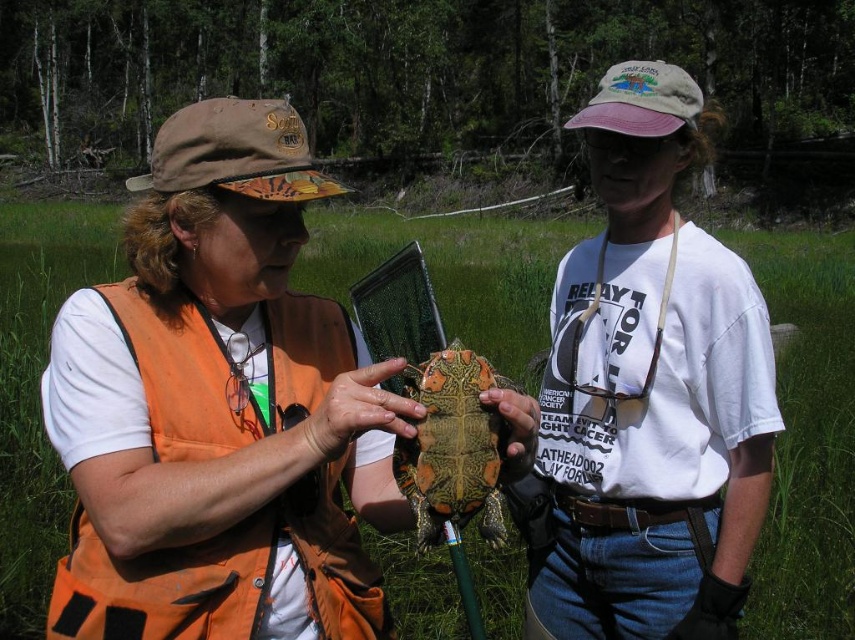
Does matte orange vest at left have a larger size compared to white cotton shirt at center?

Indeed, matte orange vest at left has a larger size compared to white cotton shirt at center.

Is matte orange vest at left to the right of white cotton shirt at center from the viewer's perspective?

Incorrect, matte orange vest at left is not on the right side of white cotton shirt at center.

I want to click on matte orange vest at left, so click(x=217, y=406).

Find the location of a particular element. matte orange vest at left is located at coordinates (217, 406).

Which is behind, point (177, 145) or point (428, 476)?

The point (177, 145) is more distant.

Is matte orange vest at left shorter than camouflage-patterned turtle at center?

Incorrect, matte orange vest at left's height does not fall short of camouflage-patterned turtle at center's.

Does point (124, 326) come farther from viewer compared to point (437, 474)?

Yes, point (124, 326) is behind point (437, 474).

I want to click on matte orange vest at left, so click(x=217, y=406).

Which is more to the left, white cotton shirt at center or camouflage-patterned turtle at center?

camouflage-patterned turtle at center

What are the coordinates of `white cotton shirt at center` in the screenshot? It's located at (647, 394).

Find the location of a particular element. This screenshot has width=855, height=640. white cotton shirt at center is located at coordinates (647, 394).